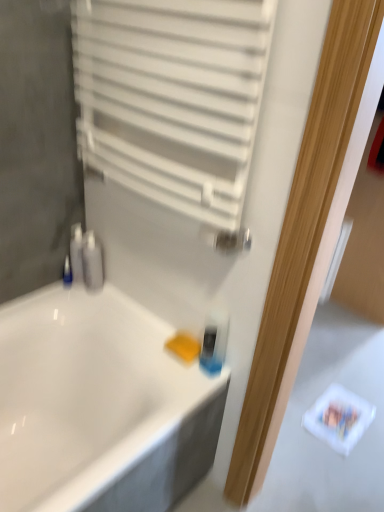
Describe the element at coordinates (214, 342) in the screenshot. This screenshot has height=512, width=384. I see `translucent plastic mouthwash at center` at that location.

Describe the element at coordinates (99, 406) in the screenshot. I see `white glossy bathtub at center` at that location.

The image size is (384, 512). In order to click on white matte radiator at upper center in this screenshot , I will do `click(172, 98)`.

Is point (94, 234) closer to camera compared to point (70, 273)?

Yes, it is.

Can you confirm if satin silver soap dispenser at left, the 1th toiletry positioned from the right, is wider than blue plastic bottle at left, which appears as the 2th toiletry when viewed from the right?

Correct, the width of satin silver soap dispenser at left, the 1th toiletry positioned from the right, exceeds that of blue plastic bottle at left, which appears as the 2th toiletry when viewed from the right.

Is satin silver soap dispenser at left, the 1th toiletry positioned from the right, closer to camera compared to blue plastic bottle at left, which appears as the 2th toiletry when viewed from the right?

Yes, it is.

Is satin silver soap dispenser at left, positioned as the 2th toiletry in left-to-right order, not within blue plastic bottle at left, which appears as the 2th toiletry when viewed from the right?

satin silver soap dispenser at left, positioned as the 2th toiletry in left-to-right order, lies outside blue plastic bottle at left, which appears as the 2th toiletry when viewed from the right,'s area.

Is white glossy bathtub at center wider or thinner than satin silver soap dispenser at left, positioned as the 2th toiletry in left-to-right order?

Considering their sizes, white glossy bathtub at center looks broader than satin silver soap dispenser at left, positioned as the 2th toiletry in left-to-right order.

Which object is positioned more to the left, white glossy bathtub at center or satin silver soap dispenser at left, the 1th toiletry positioned from the right?

From the viewer's perspective, white glossy bathtub at center appears more on the left side.

Considering the relative sizes of white glossy bathtub at center and satin silver soap dispenser at left, the 1th toiletry positioned from the right, in the image provided, is white glossy bathtub at center bigger than satin silver soap dispenser at left, the 1th toiletry positioned from the right,?

Correct, white glossy bathtub at center is larger in size than satin silver soap dispenser at left, the 1th toiletry positioned from the right.

How different are the orientations of white glossy bathtub at center and satin silver soap dispenser at left, positioned as the 2th toiletry in left-to-right order, in degrees?

There is a 90.1-degree angle between the facing directions of white glossy bathtub at center and satin silver soap dispenser at left, positioned as the 2th toiletry in left-to-right order.

Considering the sizes of blue plastic bottle at left, which appears as the 2th toiletry when viewed from the right, and yellow sponge at lower center in the image, is blue plastic bottle at left, which appears as the 2th toiletry when viewed from the right, bigger or smaller than yellow sponge at lower center?

blue plastic bottle at left, which appears as the 2th toiletry when viewed from the right, is smaller than yellow sponge at lower center.

Is blue plastic bottle at left, which is the first toiletry in left-to-right order, positioned with its back to yellow sponge at lower center?

No.

Which toiletry is the 2nd one when counting from the left side of the yellow sponge at lower center? Please provide its 2D coordinates.

[(67, 272)]

Which object is closer to the camera, blue plastic bottle at left, which appears as the 2th toiletry when viewed from the right, or yellow sponge at lower center?

yellow sponge at lower center is more forward.

Is yellow sponge at lower center bigger than blue plastic bottle at left, which is the first toiletry in left-to-right order?

Indeed, yellow sponge at lower center has a larger size compared to blue plastic bottle at left, which is the first toiletry in left-to-right order.

From the image's perspective, is yellow sponge at lower center positioned above or below blue plastic bottle at left, which appears as the 2th toiletry when viewed from the right?

Clearly, from the image's perspective, yellow sponge at lower center is below blue plastic bottle at left, which appears as the 2th toiletry when viewed from the right.

How different are the orientations of yellow sponge at lower center and blue plastic bottle at left, which is the first toiletry in left-to-right order, in degrees?

yellow sponge at lower center and blue plastic bottle at left, which is the first toiletry in left-to-right order, are facing 1.25 degrees away from each other.

From the image's perspective, which one is positioned lower, white glossy bathtub at center or translucent plastic mouthwash at center?

white glossy bathtub at center.

Identify the location of mouthwash above the white glossy bathtub at center (from the image's perspective). Image resolution: width=384 pixels, height=512 pixels. click(x=214, y=342).

Considering the sizes of objects white glossy bathtub at center and translucent plastic mouthwash at center in the image provided, who is taller, white glossy bathtub at center or translucent plastic mouthwash at center?

With more height is white glossy bathtub at center.

Is white glossy bathtub at center looking in the opposite direction of translucent plastic mouthwash at center?

No, white glossy bathtub at center is not facing away from translucent plastic mouthwash at center.

From the image's perspective, does blue plastic bottle at left, which appears as the 2th toiletry when viewed from the right, appear lower than translucent plastic mouthwash at center?

No, from the image's perspective, blue plastic bottle at left, which appears as the 2th toiletry when viewed from the right, is not below translucent plastic mouthwash at center.

Is blue plastic bottle at left, which appears as the 2th toiletry when viewed from the right, to the left or to the right of translucent plastic mouthwash at center in the image?

In the image, blue plastic bottle at left, which appears as the 2th toiletry when viewed from the right, appears on the left side of translucent plastic mouthwash at center.

Is there a large distance between blue plastic bottle at left, which is the first toiletry in left-to-right order, and translucent plastic mouthwash at center?

That's not correct — blue plastic bottle at left, which is the first toiletry in left-to-right order, is a little close to translucent plastic mouthwash at center.

From a real-world perspective, relative to translucent plastic mouthwash at center, is yellow sponge at lower center vertically above or below?

yellow sponge at lower center is below translucent plastic mouthwash at center.

Considering the sizes of objects yellow sponge at lower center and translucent plastic mouthwash at center in the image provided, who is thinner, yellow sponge at lower center or translucent plastic mouthwash at center?

With smaller width is translucent plastic mouthwash at center.

Is yellow sponge at lower center far away from translucent plastic mouthwash at center?

yellow sponge at lower center is actually quite close to translucent plastic mouthwash at center.

Is yellow sponge at lower center smaller than translucent plastic mouthwash at center?

Yes, yellow sponge at lower center is smaller than translucent plastic mouthwash at center.

Find the location of `toiletry in front of the blue plastic bottle at left, which appears as the 2th toiletry when viewed from the right`. toiletry in front of the blue plastic bottle at left, which appears as the 2th toiletry when viewed from the right is located at coordinates (92, 262).

The width and height of the screenshot is (384, 512). Find the location of `toiletry that is the 1st object located behind the white glossy bathtub at center`. toiletry that is the 1st object located behind the white glossy bathtub at center is located at coordinates (92, 262).

Estimate the real-world distances between objects in this image. Which object is closer to white matte radiator at upper center, satin silver soap dispenser at left, the 1th toiletry positioned from the right, or translucent plastic mouthwash at center?

Based on the image, translucent plastic mouthwash at center appears to be nearer to white matte radiator at upper center.

Which object lies nearer to the anchor point translucent plastic mouthwash at center, white matte radiator at upper center or yellow sponge at lower center?

yellow sponge at lower center.

From the picture: Considering their positions, is yellow sponge at lower center positioned further to satin silver soap dispenser at left, positioned as the 2th toiletry in left-to-right order, than white matte radiator at upper center?

white matte radiator at upper center.

Considering their positions, is white glossy bathtub at center positioned further to white matte radiator at upper center than satin silver soap dispenser at left, the 1th toiletry positioned from the right?

Among the two, white glossy bathtub at center is located further to white matte radiator at upper center.

Estimate the real-world distances between objects in this image. Which object is closer to satin silver soap dispenser at left, positioned as the 2th toiletry in left-to-right order, translucent plastic mouthwash at center or blue plastic bottle at left, which is the first toiletry in left-to-right order?

blue plastic bottle at left, which is the first toiletry in left-to-right order, is closer to satin silver soap dispenser at left, positioned as the 2th toiletry in left-to-right order.

When comparing their distances from white matte radiator at upper center, does blue plastic bottle at left, which is the first toiletry in left-to-right order, or satin silver soap dispenser at left, the 1th toiletry positioned from the right, seem closer?

satin silver soap dispenser at left, the 1th toiletry positioned from the right.

Which object lies further to the anchor point satin silver soap dispenser at left, the 1th toiletry positioned from the right, white glossy bathtub at center or yellow sponge at lower center?

Based on the image, yellow sponge at lower center appears to be further to satin silver soap dispenser at left, the 1th toiletry positioned from the right.

Considering their positions, is white matte radiator at upper center positioned further to yellow sponge at lower center than translucent plastic mouthwash at center?

Based on the image, white matte radiator at upper center appears to be further to yellow sponge at lower center.

Where is `soap located between white glossy bathtub at center and translucent plastic mouthwash at center in the left-right direction`? soap located between white glossy bathtub at center and translucent plastic mouthwash at center in the left-right direction is located at coordinates (184, 347).

The height and width of the screenshot is (512, 384). Find the location of `soap located between white glossy bathtub at center and blue plastic bottle at left, which appears as the 2th toiletry when viewed from the right, in the depth direction`. soap located between white glossy bathtub at center and blue plastic bottle at left, which appears as the 2th toiletry when viewed from the right, in the depth direction is located at coordinates (184, 347).

This screenshot has width=384, height=512. Identify the location of mouthwash between white matte radiator at upper center and yellow sponge at lower center vertically. (214, 342).

Find the location of `soap located between blue plastic bottle at left, which appears as the 2th toiletry when viewed from the right, and translucent plastic mouthwash at center in the left-right direction`. soap located between blue plastic bottle at left, which appears as the 2th toiletry when viewed from the right, and translucent plastic mouthwash at center in the left-right direction is located at coordinates (184, 347).